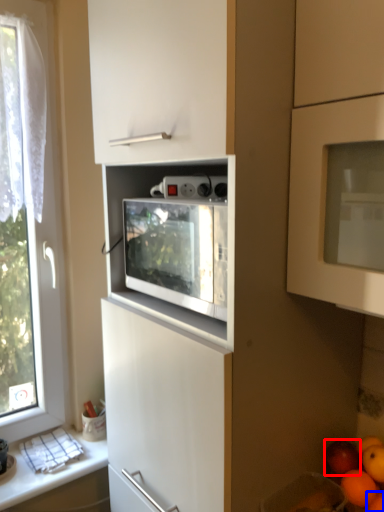
Question: Which object appears closest to the camera in this image, apple (highlighted by a red box) or orange (highlighted by a blue box)?

Choices:
 (A) apple
 (B) orange

Answer: (B)